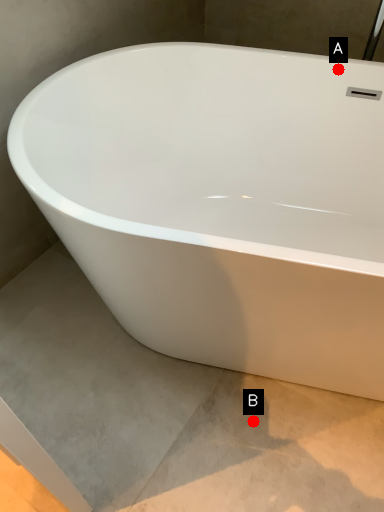
Question: Two points are circled on the image, labeled by A and B beside each circle. Which point appears farthest from the camera in this image?

Choices:
 (A) A is further
 (B) B is further

Answer: (A)